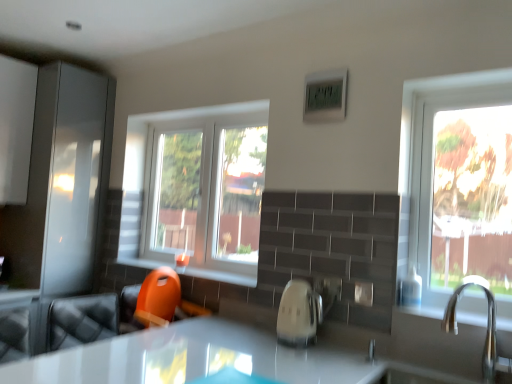
Question: Could silver metallic faucet at right be considered to be inside orange plastic toy at lower center?

Choices:
 (A) no
 (B) yes

Answer: (A)

Question: Is orange plastic toy at lower center looking in the opposite direction of silver metallic faucet at right?

Choices:
 (A) no
 (B) yes

Answer: (A)

Question: From the image's perspective, is orange plastic toy at lower center below silver metallic faucet at right?

Choices:
 (A) yes
 (B) no

Answer: (B)

Question: From a real-world perspective, does orange plastic toy at lower center sit lower than silver metallic faucet at right?

Choices:
 (A) yes
 (B) no

Answer: (B)

Question: Is orange plastic toy at lower center next to silver metallic faucet at right and touching it?

Choices:
 (A) yes
 (B) no

Answer: (B)

Question: Is silver metallic faucet at right in front of or behind white glossy kettle at center in the image?

Choices:
 (A) front
 (B) behind

Answer: (A)

Question: Considering the positions of point (487, 304) and point (305, 322), is point (487, 304) closer or farther from the camera than point (305, 322)?

Choices:
 (A) closer
 (B) farther

Answer: (A)

Question: Looking at their shapes, would you say silver metallic faucet at right is wider or thinner than white glossy kettle at center?

Choices:
 (A) thin
 (B) wide

Answer: (B)

Question: Would you say silver metallic faucet at right is to the left or to the right of white glossy kettle at center in the picture?

Choices:
 (A) left
 (B) right

Answer: (B)

Question: In the image, is orange plastic toy at lower center positioned in front of or behind white glossy kettle at center?

Choices:
 (A) behind
 (B) front

Answer: (A)

Question: Considering the relative positions of orange plastic toy at lower center and white glossy kettle at center in the image provided, is orange plastic toy at lower center to the left or to the right of white glossy kettle at center?

Choices:
 (A) right
 (B) left

Answer: (B)

Question: From the image's perspective, relative to white glossy kettle at center, is orange plastic toy at lower center above or below?

Choices:
 (A) above
 (B) below

Answer: (A)

Question: Is orange plastic toy at lower center bigger or smaller than white glossy kettle at center?

Choices:
 (A) big
 (B) small

Answer: (A)

Question: From the image's perspective, is clear glass window at center above or below silver metallic faucet at right?

Choices:
 (A) below
 (B) above

Answer: (B)

Question: In terms of width, does clear glass window at center look wider or thinner when compared to silver metallic faucet at right?

Choices:
 (A) wide
 (B) thin

Answer: (B)